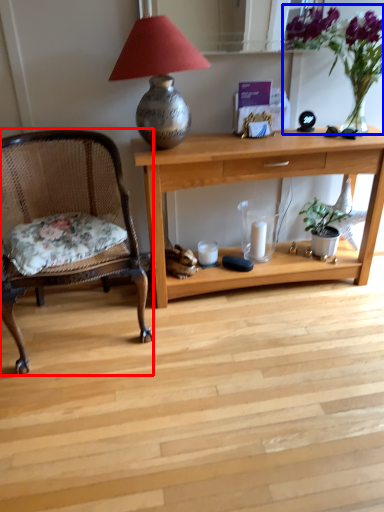
Question: Which object is further to the camera taking this photo, chair (highlighted by a red box) or floral arrangement (highlighted by a blue box)?

Choices:
 (A) chair
 (B) floral arrangement

Answer: (B)